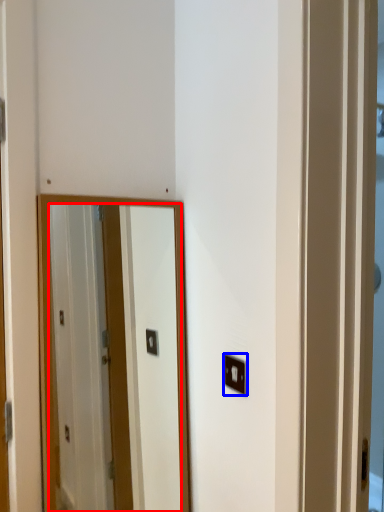
Question: Among these objects, which one is farthest to the camera, mirror (highlighted by a red box) or light switch (highlighted by a blue box)?

Choices:
 (A) mirror
 (B) light switch

Answer: (B)